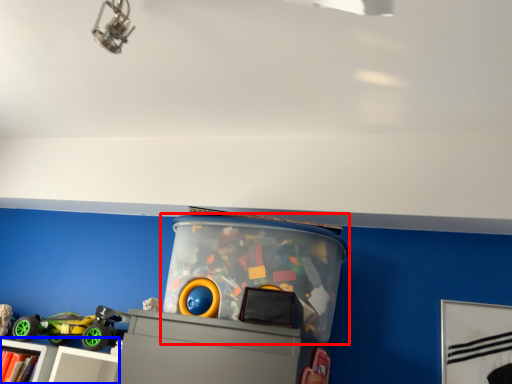
Question: Among these objects, which one is farthest to the camera, toy (highlighted by a red box) or shelf (highlighted by a blue box)?

Choices:
 (A) toy
 (B) shelf

Answer: (B)